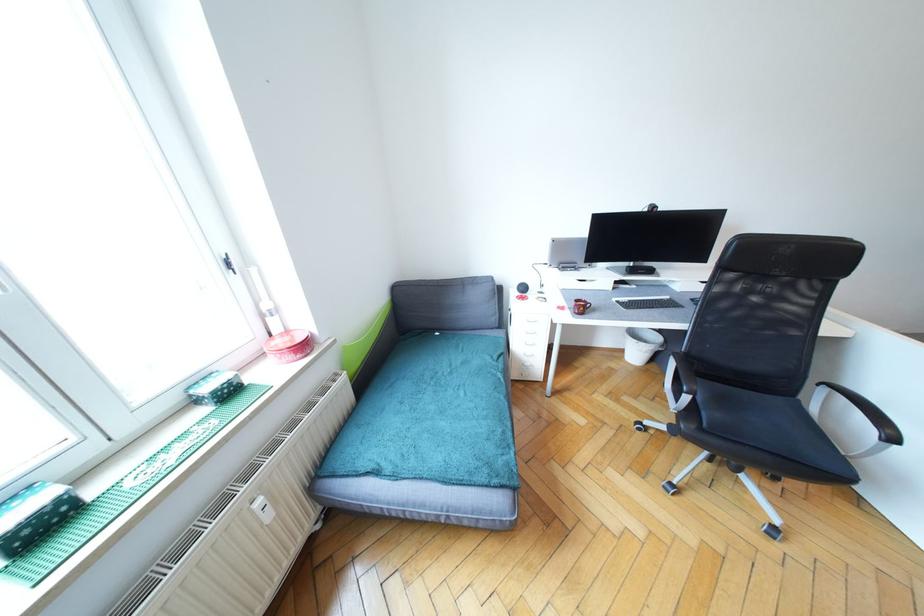
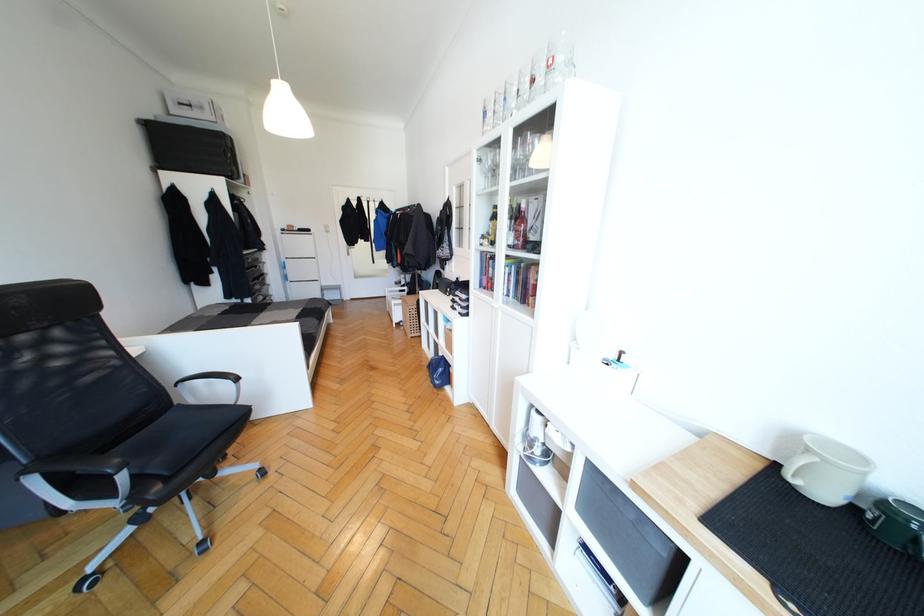
Locate, in the second image, the point that corresponds to (896,440) in the first image.

(239, 379)